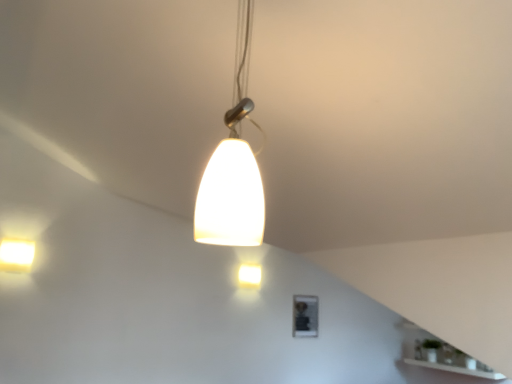
Question: Considering the relative sizes of matte white light fixture at center, which is the second lamp from left to right, and matte white light fixture at upper left, the 2th lamp in the bottom-to-top sequence, in the image provided, is matte white light fixture at center, which is the second lamp from left to right, taller than matte white light fixture at upper left, the 2th lamp in the bottom-to-top sequence,?

Choices:
 (A) yes
 (B) no

Answer: (B)

Question: Is matte white light fixture at upper left, positioned as the first lamp in left-to-right order, at the back of matte white light fixture at center, placed as the first lamp when sorted from back to front?

Choices:
 (A) yes
 (B) no

Answer: (B)

Question: Is the surface of matte white light fixture at center, which is counted as the 1th lamp, starting from the bottom, in direct contact with matte white light fixture at upper left, placed as the 2th lamp when sorted from back to front?

Choices:
 (A) no
 (B) yes

Answer: (A)

Question: Is matte white light fixture at center, placed as the third lamp when sorted from front to back, not within matte white light fixture at upper left, the 3th lamp viewed from the right?

Choices:
 (A) no
 (B) yes

Answer: (B)

Question: Is matte white light fixture at center, which is the second lamp from left to right, positioned behind matte white light fixture at upper left, acting as the second lamp starting from the front?

Choices:
 (A) no
 (B) yes

Answer: (B)

Question: Do you think matte white pendant light at center, positioned as the 3th lamp in left-to-right order, is within matte white light fixture at center, the 3th lamp viewed from the top, or outside of it?

Choices:
 (A) inside
 (B) outside

Answer: (B)

Question: Is matte white pendant light at center, the third lamp in the bottom-to-top sequence, bigger or smaller than matte white light fixture at center, placed as the first lamp when sorted from back to front?

Choices:
 (A) small
 (B) big

Answer: (B)

Question: Would you say matte white pendant light at center, arranged as the first lamp when viewed from the top, is to the left or to the right of matte white light fixture at center, which is counted as the 1th lamp, starting from the bottom, in the picture?

Choices:
 (A) right
 (B) left

Answer: (A)

Question: In terms of height, does matte white pendant light at center, acting as the first lamp starting from the front, look taller or shorter compared to matte white light fixture at center, which is the second lamp from left to right?

Choices:
 (A) short
 (B) tall

Answer: (B)

Question: Is matte white light fixture at upper left, positioned as the first lamp in left-to-right order, inside the boundaries of matte white pendant light at center, positioned as the 3th lamp in left-to-right order, or outside?

Choices:
 (A) inside
 (B) outside

Answer: (B)

Question: Is matte white light fixture at upper left, acting as the second lamp starting from the front, to the left or to the right of matte white pendant light at center, arranged as the first lamp when viewed from the top, in the image?

Choices:
 (A) left
 (B) right

Answer: (A)

Question: In the image, is matte white light fixture at upper left, acting as the second lamp starting from the front, positioned in front of or behind matte white pendant light at center, arranged as the first lamp when viewed from the top?

Choices:
 (A) front
 (B) behind

Answer: (B)

Question: From a real-world perspective, is matte white light fixture at upper left, acting as the second lamp starting from the front, physically located above or below matte white pendant light at center, acting as the first lamp starting from the front?

Choices:
 (A) above
 (B) below

Answer: (B)

Question: Looking at their shapes, would you say matte white pendant light at center, acting as the first lamp starting from the front, is wider or thinner than matte white light fixture at upper left, placed as the 2th lamp when sorted from back to front?

Choices:
 (A) wide
 (B) thin

Answer: (A)

Question: Is matte white pendant light at center, arranged as the first lamp when viewed from the top, inside or outside of matte white light fixture at upper left, placed as the 2th lamp when sorted from back to front?

Choices:
 (A) outside
 (B) inside

Answer: (A)